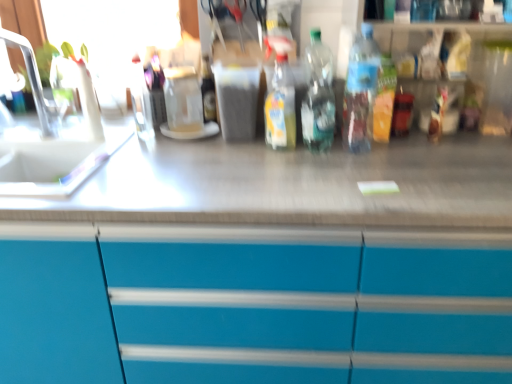
The image size is (512, 384). In order to click on free point in front of clear plastic bottle at upper center, marked as the 1th bottle in a left-to-right arrangement in this screenshot , I will do `click(134, 149)`.